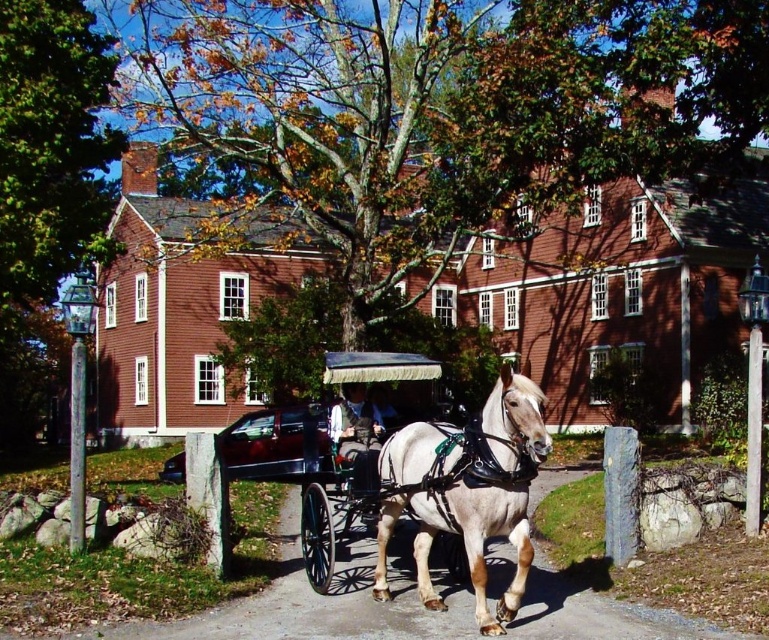
You are a tourist standing in front of the historic brick building and see both the white leather wagon at center and the smooth black coach at center. Which one is positioned higher up in the image?

The white leather wagon at center is positioned higher up in the image than the smooth black coach at center because it is above it.

You are standing in front of the historic brick building and see the white glossy horse at center and the smooth black coach at center. Which object is positioned to the right of the other?

The white glossy horse at center is to the right of the smooth black coach at center.

You are a tour guide who needs to move a 40 centimeter wide luggage cart from the white leather wagon at center to the smooth black coach at center. Is there enough space between them to move the luggage cart without tilting it?

The distance between the white leather wagon at center and the smooth black coach at center is 42.57 centimeters, which is slightly more than the 40 centimeter width of the luggage cart. Therefore, there is enough space to move the luggage cart without tilting it.